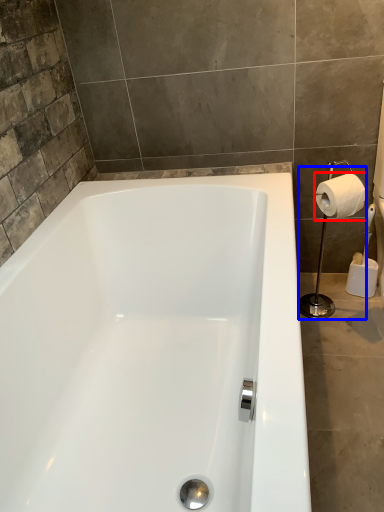
Question: Which object appears closest to the camera in this image, toilet paper (highlighted by a red box) or shower (highlighted by a blue box)?

Choices:
 (A) toilet paper
 (B) shower

Answer: (A)